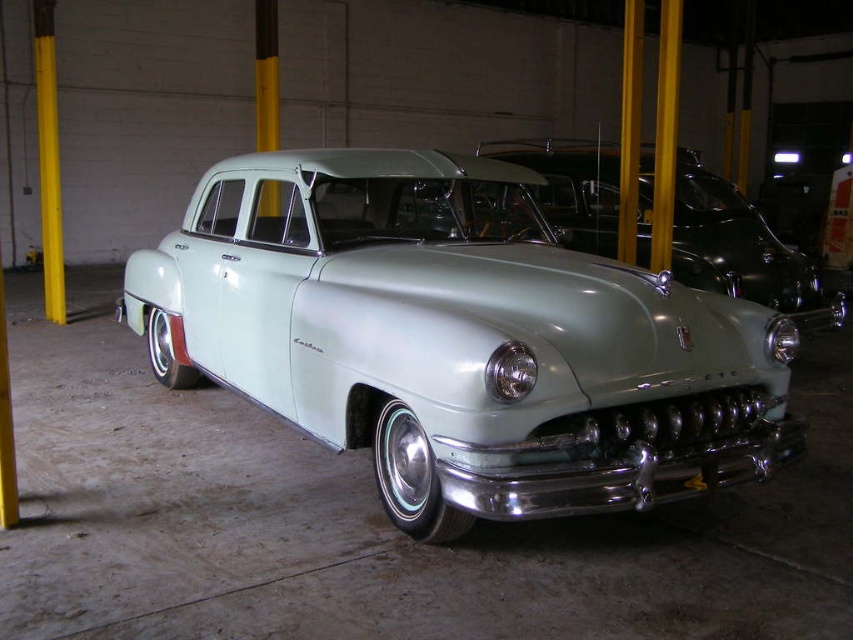
Does satin light green car at center have a lesser width compared to light green metallic car at center?

Indeed, satin light green car at center has a lesser width compared to light green metallic car at center.

Does satin light green car at center lie in front of light green metallic car at center?

Yes, satin light green car at center is in front of light green metallic car at center.

Is point (657, 490) positioned before point (747, 276)?

Yes, point (657, 490) is closer to viewer.

I want to click on satin light green car at center, so click(x=457, y=339).